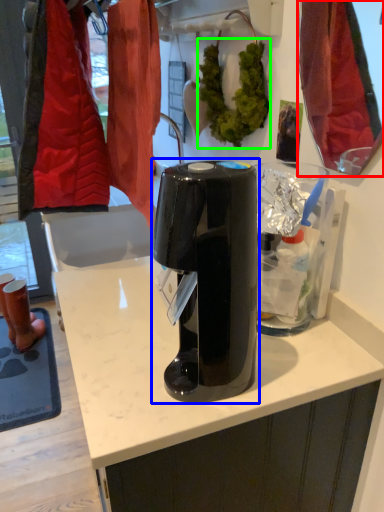
Question: Which object is positioned closest to mirror (highlighted by a red box)? Select from home appliance (highlighted by a blue box) and plant (highlighted by a green box).

Choices:
 (A) home appliance
 (B) plant

Answer: (B)